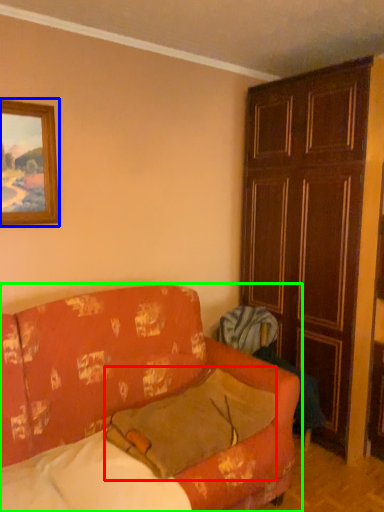
Question: Considering the real-world distances, which object is closest to pillow (highlighted by a red box)? picture frame (highlighted by a blue box) or studio couch (highlighted by a green box).

Choices:
 (A) picture frame
 (B) studio couch

Answer: (B)